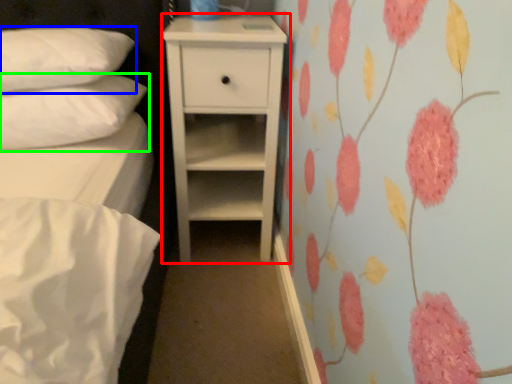
Question: Considering the real-world distances, which object is closest to chest of drawers (highlighted by a red box)? pillow (highlighted by a blue box) or pillow (highlighted by a green box).

Choices:
 (A) pillow
 (B) pillow

Answer: (B)